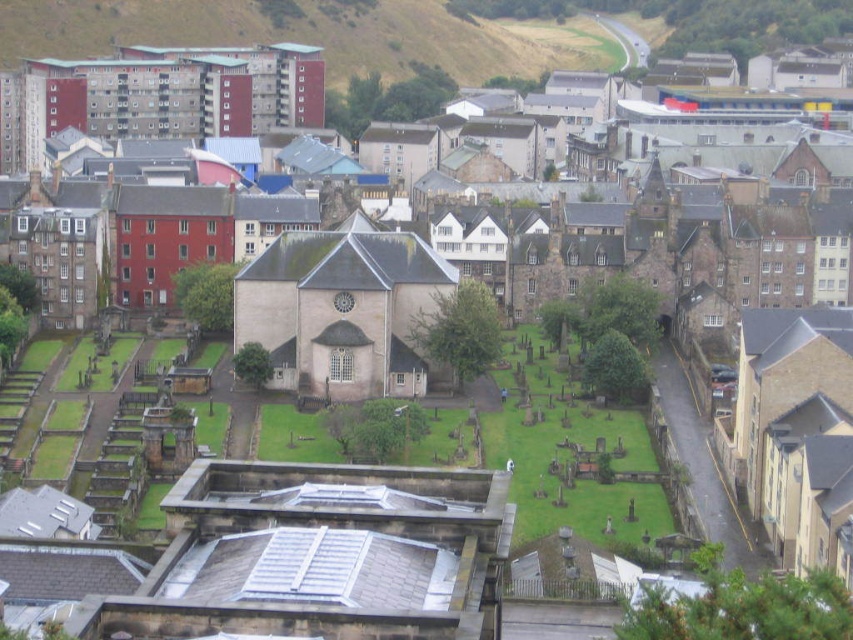
Question: Which point is farther to the camera?

Choices:
 (A) matte brick church at upper left
 (B) smooth stone church at center

Answer: (A)

Question: Is smooth stone church at center positioned at the back of matte brick church at upper left?

Choices:
 (A) no
 (B) yes

Answer: (A)

Question: Among these points, which one is nearest to the camera?

Choices:
 (A) (283, 360)
 (B) (59, 65)

Answer: (A)

Question: Is smooth stone church at center above matte brick church at upper left?

Choices:
 (A) no
 (B) yes

Answer: (A)

Question: Does smooth stone church at center come in front of matte brick church at upper left?

Choices:
 (A) no
 (B) yes

Answer: (B)